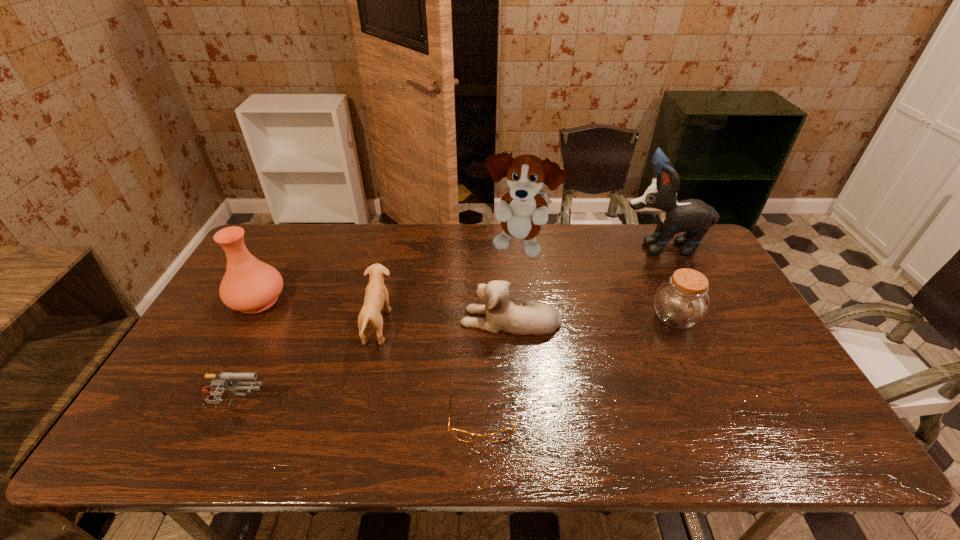
In order to click on the third closest object to the jar in this screenshot , I will do `click(521, 211)`.

Locate an element on the screen. puppy that is the second closest to the seventh tallest object is located at coordinates (532, 319).

Where is `puppy that is the second closest to the jar`? puppy that is the second closest to the jar is located at coordinates (532, 319).